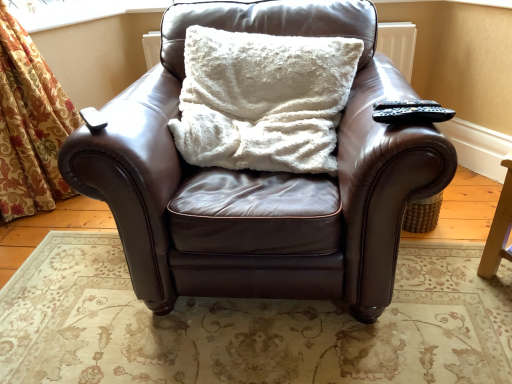
Question: Considering the relative sizes of transparent plastic window screen at upper left and white fluffy pillow at center in the image provided, is transparent plastic window screen at upper left thinner than white fluffy pillow at center?

Choices:
 (A) yes
 (B) no

Answer: (A)

Question: Can you confirm if transparent plastic window screen at upper left is positioned to the left of white fluffy pillow at center?

Choices:
 (A) yes
 (B) no

Answer: (A)

Question: Would you say transparent plastic window screen at upper left is outside white fluffy pillow at center?

Choices:
 (A) yes
 (B) no

Answer: (A)

Question: Is the surface of transparent plastic window screen at upper left in direct contact with white fluffy pillow at center?

Choices:
 (A) no
 (B) yes

Answer: (A)

Question: From a real-world perspective, is transparent plastic window screen at upper left beneath white fluffy pillow at center?

Choices:
 (A) no
 (B) yes

Answer: (A)

Question: From their relative heights in the image, would you say brown leather chair at center is taller or shorter than transparent plastic window screen at upper left?

Choices:
 (A) short
 (B) tall

Answer: (B)

Question: Is brown leather chair at center inside or outside of transparent plastic window screen at upper left?

Choices:
 (A) inside
 (B) outside

Answer: (B)

Question: Is brown leather chair at center wider or thinner than transparent plastic window screen at upper left?

Choices:
 (A) thin
 (B) wide

Answer: (B)

Question: Is brown leather chair at center to the left or to the right of transparent plastic window screen at upper left in the image?

Choices:
 (A) right
 (B) left

Answer: (A)

Question: Would you say brown leather chair at center is to the left or to the right of white fluffy pillow at center in the picture?

Choices:
 (A) right
 (B) left

Answer: (B)

Question: In terms of width, does brown leather chair at center look wider or thinner when compared to white fluffy pillow at center?

Choices:
 (A) thin
 (B) wide

Answer: (B)

Question: From the image's perspective, relative to white fluffy pillow at center, is brown leather chair at center above or below?

Choices:
 (A) below
 (B) above

Answer: (A)

Question: Is brown leather chair at center in front of or behind white fluffy pillow at center in the image?

Choices:
 (A) behind
 (B) front

Answer: (B)

Question: Is transparent plastic window screen at upper left situated inside black plastic remote at upper right or outside?

Choices:
 (A) inside
 (B) outside

Answer: (B)

Question: In terms of height, does transparent plastic window screen at upper left look taller or shorter compared to black plastic remote at upper right?

Choices:
 (A) tall
 (B) short

Answer: (B)